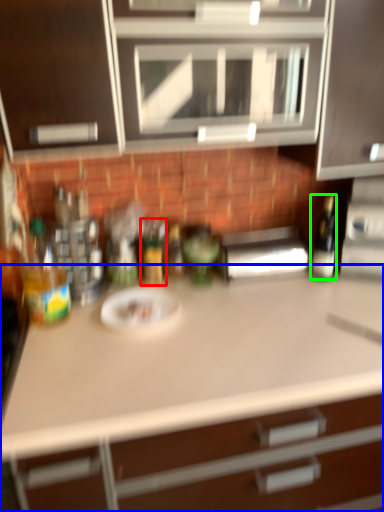
Question: Based on their relative distances, which object is farther from bottle (highlighted by a red box)? Choose from countertop (highlighted by a blue box) and bottle (highlighted by a green box).

Choices:
 (A) countertop
 (B) bottle

Answer: (A)